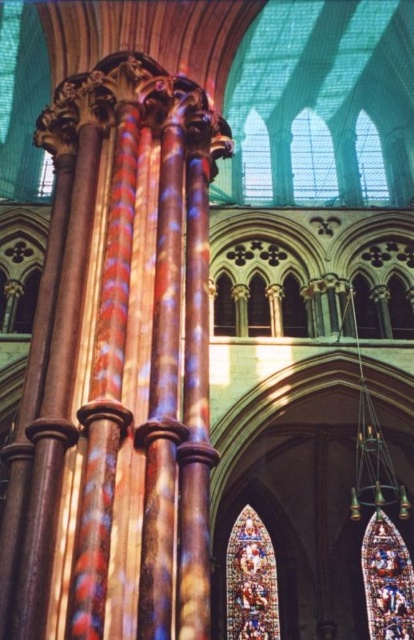
Looking at this image, you are standing at the entrance of the cathedral and notice a point marked at coordinates point (21, 97). What object is located at this specific coordinate?

The point (21, 97) is where the stained glass window at upper left is located.

You are standing inside a cathedral and want to take a closer look at the stained glass window at upper center. Given that you can walk up to 40 meters, will you be able to get close enough to touch it?

The stained glass window at upper center is 42.32 meters away from camera, so you cannot reach it within your 40 meters limit. You need to move 2.32 meters more to touch it.

You are an architect visiting the cathedral and want to compare the stained glass windows. Which stained glass window is taller between the stained glass window at upper center and the stained glass window at center?

The stained glass window at upper center is much taller than the stained glass window at center.